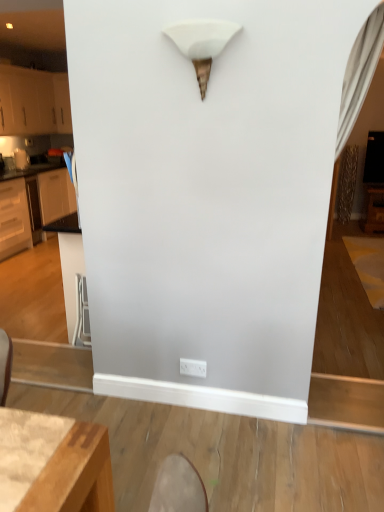
Question: Does white matte cabinet at left, positioned as the second cabinetry in bottom-to-top order, lie in front of white plastic electric outlet at lower center?

Choices:
 (A) yes
 (B) no

Answer: (B)

Question: Considering the relative sizes of white matte cabinet at left, the 1th cabinetry viewed from the top, and white plastic electric outlet at lower center in the image provided, is white matte cabinet at left, the 1th cabinetry viewed from the top, smaller than white plastic electric outlet at lower center?

Choices:
 (A) no
 (B) yes

Answer: (A)

Question: Does white matte cabinet at left, the 1th cabinetry viewed from the top, contain white plastic electric outlet at lower center?

Choices:
 (A) yes
 (B) no

Answer: (B)

Question: Is white matte cabinet at left, the 1th cabinetry viewed from the top, not within white plastic electric outlet at lower center?

Choices:
 (A) no
 (B) yes

Answer: (B)

Question: Is white matte cabinet at left, positioned as the second cabinetry in bottom-to-top order, bigger than white plastic electric outlet at lower center?

Choices:
 (A) yes
 (B) no

Answer: (A)

Question: From a real-world perspective, is white matte cabinet at left, the 1th cabinetry viewed from the top, physically below white plastic electric outlet at lower center?

Choices:
 (A) no
 (B) yes

Answer: (A)

Question: Is white matte cone at upper center thinner than white matte cabinet at left, positioned as the second cabinetry in bottom-to-top order?

Choices:
 (A) yes
 (B) no

Answer: (A)

Question: From the image's perspective, is white matte cone at upper center below white matte cabinet at left, positioned as the second cabinetry in bottom-to-top order?

Choices:
 (A) yes
 (B) no

Answer: (A)

Question: Is white matte cone at upper center oriented away from white matte cabinet at left, the 1th cabinetry viewed from the top?

Choices:
 (A) yes
 (B) no

Answer: (B)

Question: From a real-world perspective, does white matte cone at upper center sit lower than white matte cabinet at left, the 1th cabinetry viewed from the top?

Choices:
 (A) no
 (B) yes

Answer: (A)

Question: Can you confirm if white matte cone at upper center is positioned to the left of white matte cabinet at left, the 1th cabinetry viewed from the top?

Choices:
 (A) no
 (B) yes

Answer: (A)

Question: Is white matte cone at upper center to the right of white matte cabinet at left, positioned as the second cabinetry in bottom-to-top order, from the viewer's perspective?

Choices:
 (A) no
 (B) yes

Answer: (B)

Question: Is white plastic electric outlet at lower center oriented towards white matte cone at upper center?

Choices:
 (A) yes
 (B) no

Answer: (B)